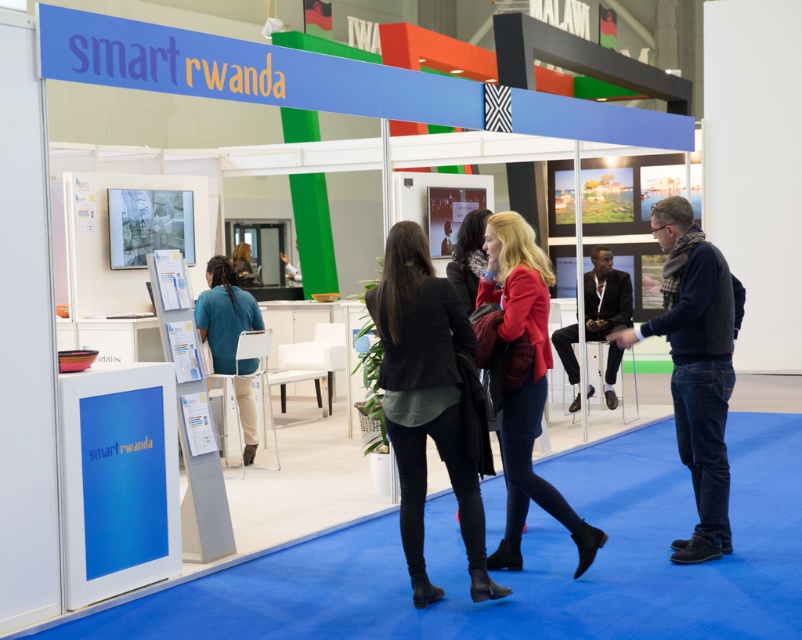
Does black leather jacket at center come in front of blue fabric shirt at center?

Yes.

Which is behind, point (412, 385) or point (211, 282)?

The point (211, 282) is behind.

Who is more distant from viewer, (406, 497) or (244, 412)?

Point (244, 412)

Where is `black leather jacket at center`? The image size is (802, 640). black leather jacket at center is located at coordinates (426, 401).

Locate an element on the screen. This screenshot has width=802, height=640. black leather jacket at center is located at coordinates (426, 401).

Can you confirm if black leather jacket at center is shorter than red leather jacket at center?

Yes, black leather jacket at center is shorter than red leather jacket at center.

What do you see at coordinates (426, 401) in the screenshot? I see `black leather jacket at center` at bounding box center [426, 401].

At what (x,y) coordinates should I click in order to perform the action: click on black leather jacket at center. Please return your answer as a coordinate pair (x, y). Looking at the image, I should click on (426, 401).

Describe the element at coordinates (525, 384) in the screenshot. I see `red leather jacket at center` at that location.

Who is higher up, red leather jacket at center or blue fabric shirt at center?

Positioned higher is blue fabric shirt at center.

I want to click on red leather jacket at center, so click(525, 384).